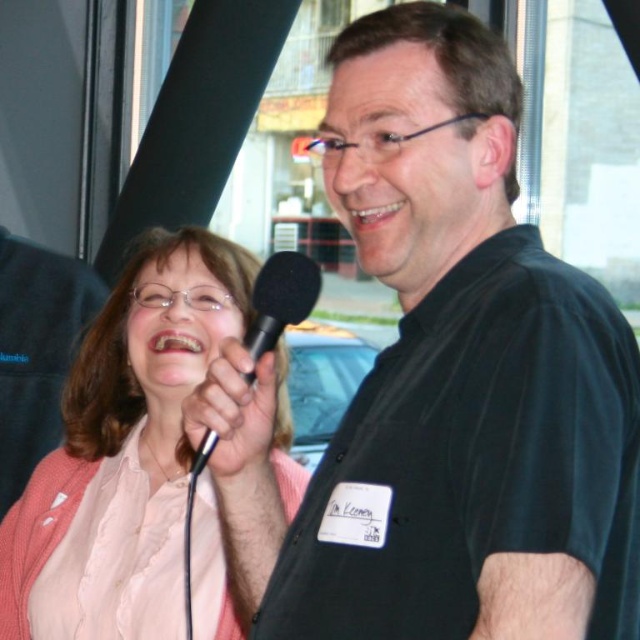
Looking at this image, you are a photographer on a bus and need to capture a clear shot of the black matte microphone at center without the pink fabric at upper left blocking it. Can you adjust your position to do so?

The black matte microphone at center is behind the pink fabric at upper left, so moving your position to the side or forward might allow you to see around or over the fabric to capture the microphone clearly.

You are a photographer on a bus and you want to take a photo of the pink fabric at upper left and the black matte microphone at center. Which object is closer to the bottom edge of the photo?

The pink fabric at upper left is below the black matte microphone at center, so the pink fabric at upper left is closer to the bottom edge of the photo.